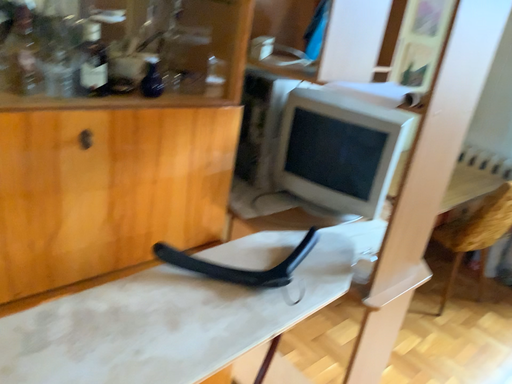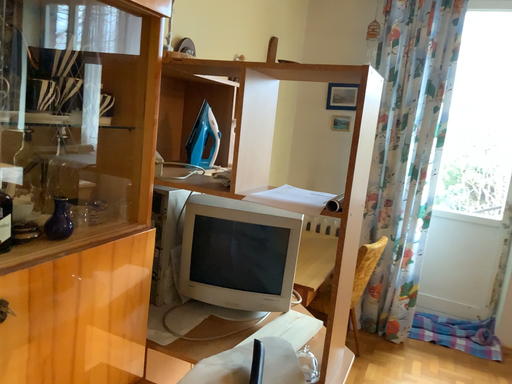
Question: Which way did the camera rotate in the video?

Choices:
 (A) rotated downward
 (B) rotated upward

Answer: (B)